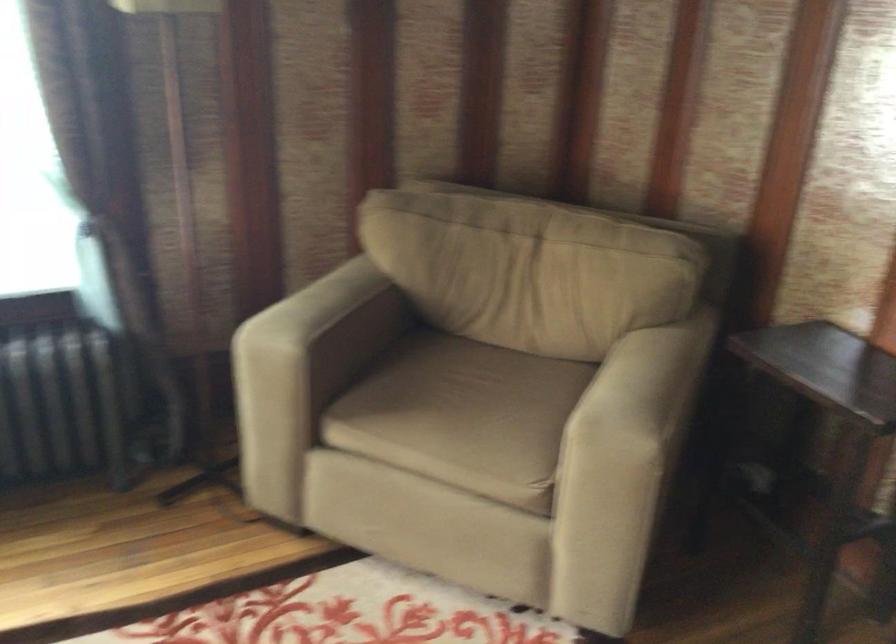
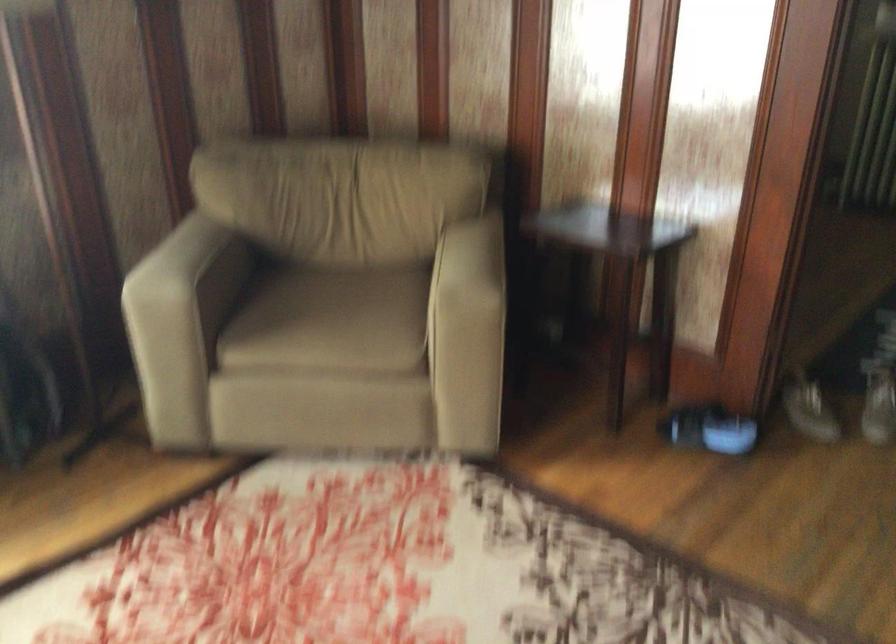
Where in the second image is the point corresponding to point (452, 413) from the first image?

(331, 321)